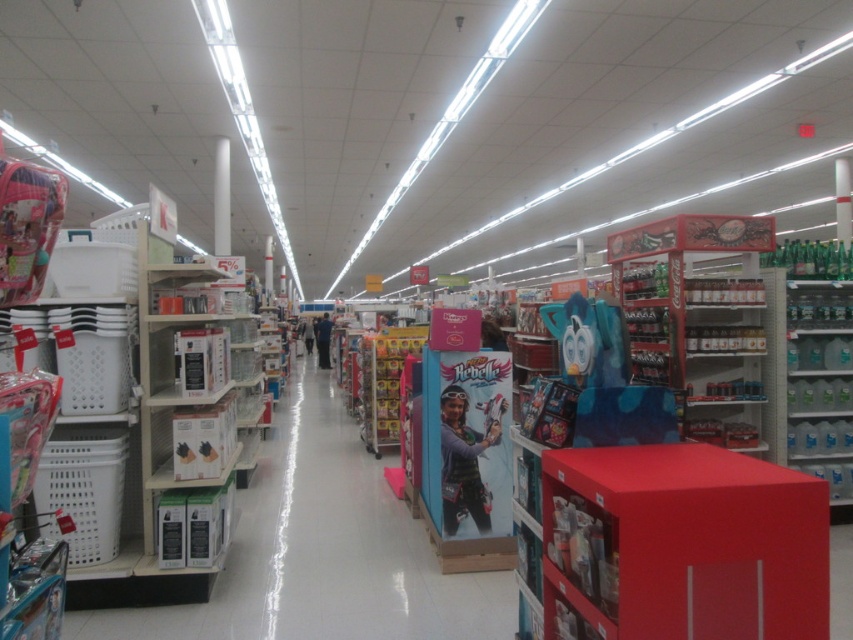
Between white plastic basket at left and white glossy pillar at center, which one appears on the right side from the viewer's perspective?

white plastic basket at left

Who is taller, white plastic basket at left or white glossy pillar at center?

white glossy pillar at center

This screenshot has height=640, width=853. In order to click on white plastic basket at left in this screenshot , I will do `click(322, 550)`.

Between point (219, 227) and point (323, 352), which one is positioned in front?

Point (219, 227) is in front.

Does point (218, 204) lie behind point (329, 328)?

That is False.

I want to click on white glossy pillar at center, so click(x=221, y=196).

Does white glossy pillar at center come in front of green plastic pillar at center?

Yes, it is in front of green plastic pillar at center.

Does white glossy pillar at center have a greater height compared to green plastic pillar at center?

Correct, white glossy pillar at center is much taller as green plastic pillar at center.

Locate an element on the screen. white glossy pillar at center is located at coordinates (221, 196).